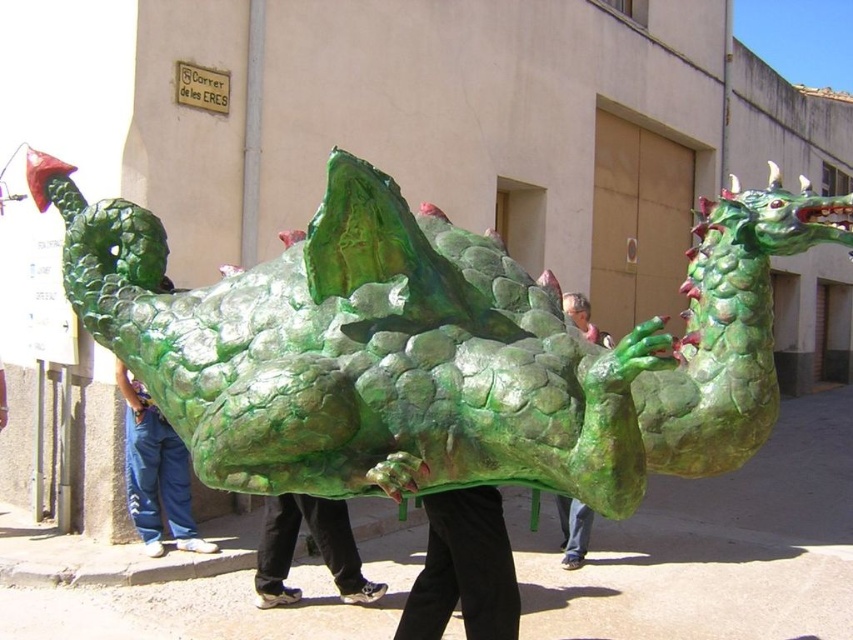
Question: Is blue jeans at lower left positioned behind green matte dragon at center?

Choices:
 (A) yes
 (B) no

Answer: (B)

Question: Is blue jeans at lower left bigger than green matte pants at center?

Choices:
 (A) no
 (B) yes

Answer: (B)

Question: Which point is farther to the camera?

Choices:
 (A) (584, 556)
 (B) (187, 490)

Answer: (A)

Question: Which point is closer to the camera?

Choices:
 (A) (318, 509)
 (B) (143, 525)
 (C) (596, 336)
 (D) (508, 310)

Answer: (D)

Question: Which of the following is the closest to the observer?

Choices:
 (A) (550, 369)
 (B) (131, 513)

Answer: (A)

Question: Does green scaly dragon at center lie behind blue jeans at lower left?

Choices:
 (A) yes
 (B) no

Answer: (B)